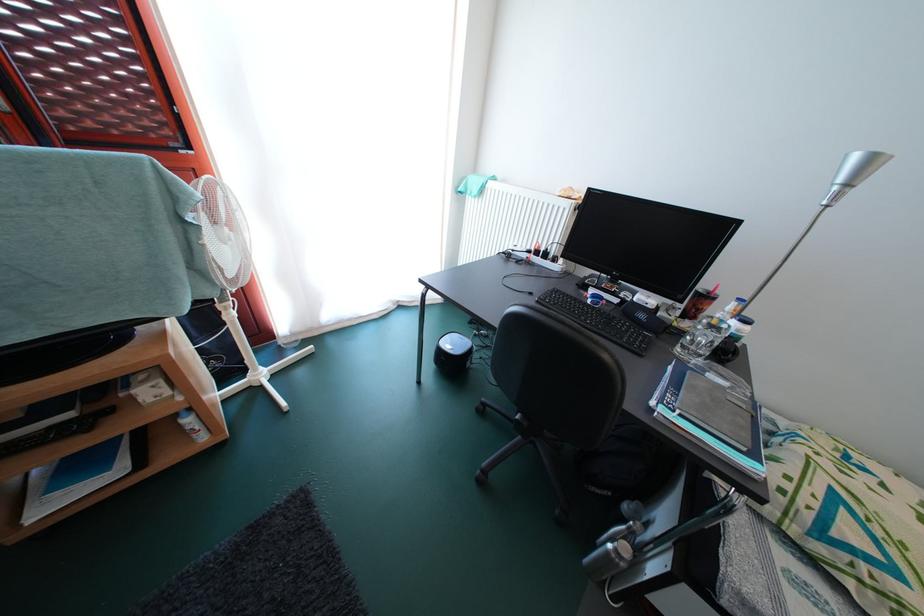
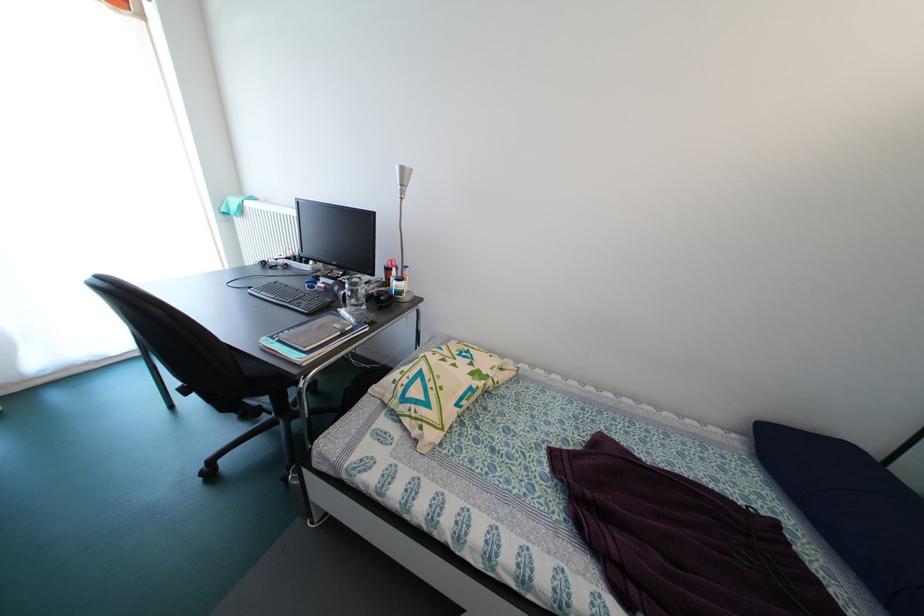
The point at (650,321) is marked in the first image. Where is the corresponding point in the second image?

(344, 294)